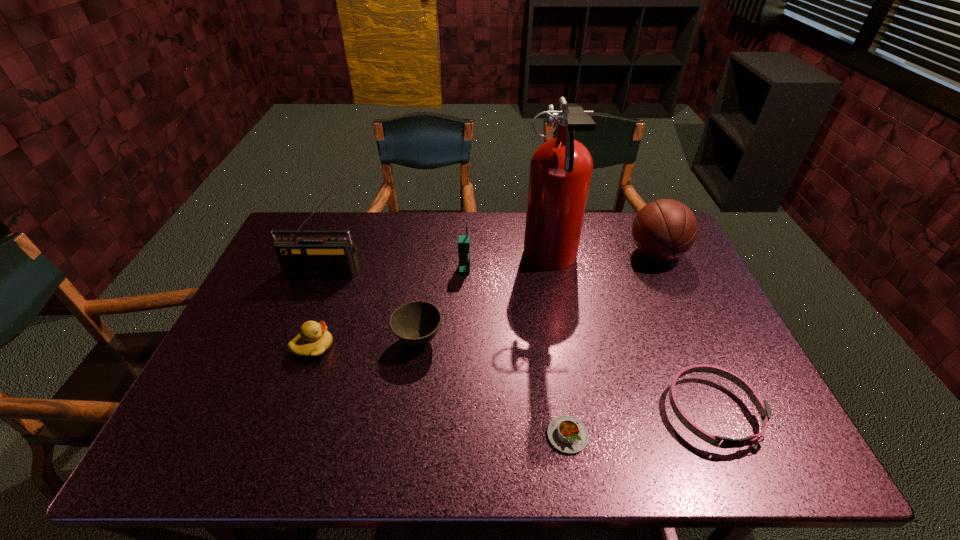
Image resolution: width=960 pixels, height=540 pixels. Identify the location of the tallest object. (561, 168).

In order to click on the seventh shortest object in this screenshot , I will do click(300, 257).

Where is `basketball`? The image size is (960, 540). basketball is located at coordinates (664, 229).

Where is `cellular telephone`? This screenshot has height=540, width=960. cellular telephone is located at coordinates (463, 240).

Locate an element on the screen. the sixth object from right to left is located at coordinates (415, 323).

Where is `duckling`? Image resolution: width=960 pixels, height=540 pixels. duckling is located at coordinates (313, 340).

Where is `the seventh tallest object`? The image size is (960, 540). the seventh tallest object is located at coordinates (762, 406).

This screenshot has height=540, width=960. Find the location of `pudding`. pudding is located at coordinates (569, 435).

At what (x,y) coordinates should I click in order to perform the action: click on blank area located 0.320m on the front of the fire extinguisher. Please return your answer as a coordinate pair (x, y). This screenshot has height=540, width=960. Looking at the image, I should click on (572, 381).

Where is `vacant space located on the front-facing side of the second tallest object`? The width and height of the screenshot is (960, 540). vacant space located on the front-facing side of the second tallest object is located at coordinates (299, 343).